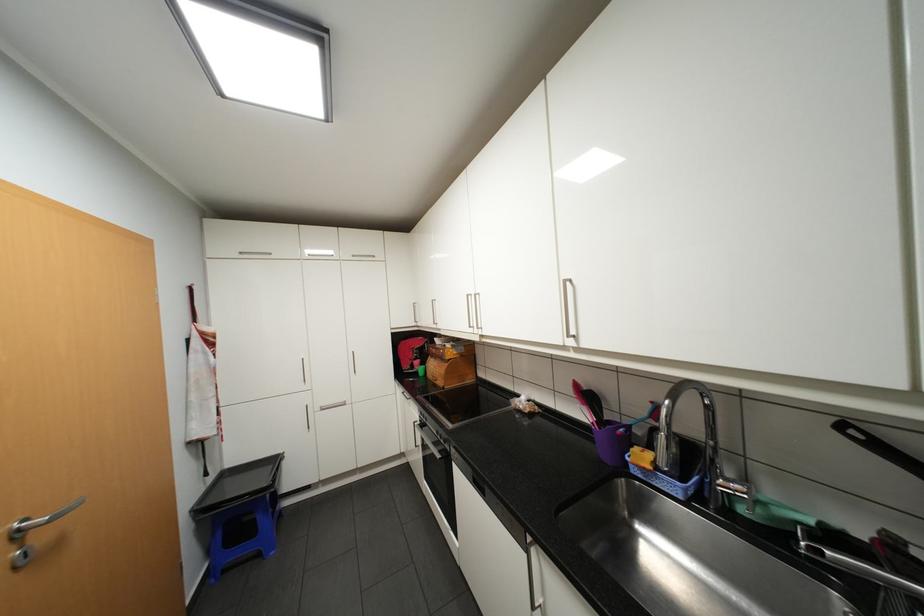
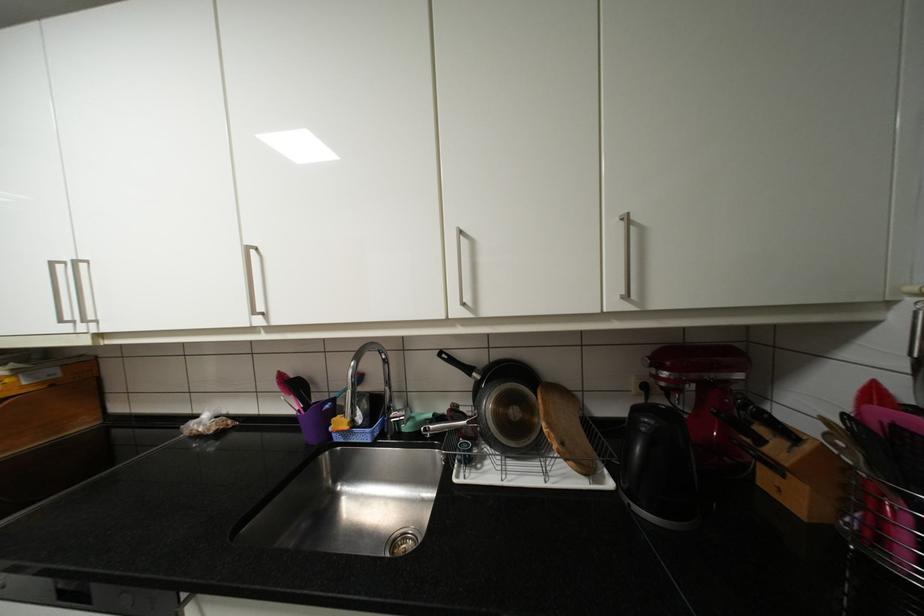
Question: The first image is from the beginning of the video and the second image is from the end. How did the camera likely rotate when shooting the video?

Choices:
 (A) Left
 (B) Right
 (C) Up
 (D) Down

Answer: (B)